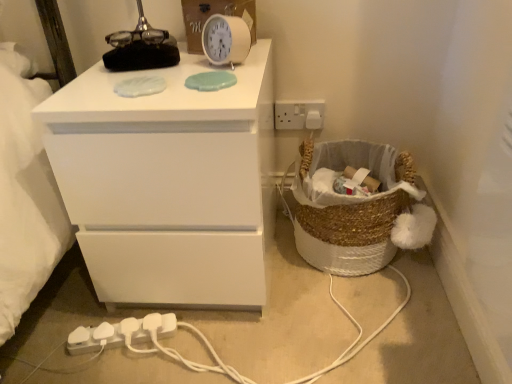
Where is `free space between white matte chest of drawers at upper left and braided wicker basket at lower right`? The height and width of the screenshot is (384, 512). free space between white matte chest of drawers at upper left and braided wicker basket at lower right is located at coordinates (308, 288).